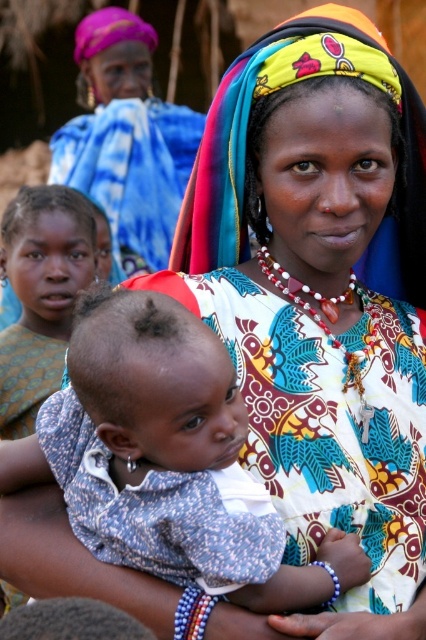
You are a photographer standing at the position of the central woman holding the baby. You want to take a photo of the matte colorful headscarf at upper center and the other woman wearing a pink headscarf and blue garment. Are both subjects within your camera lens field of view if your camera has a 50 meter focal length?

The two subjects are 50.64 meters apart. Since the camera has a 50 meter focal length, the distance between them exceeds the focal length, so they cannot both be in the same frame. Adjust your position or use a different lens.

You are an observer looking at the scene. Which object is wider between the blue dotted fabric baby at center and the matte colorful headscarf at upper center?

The blue dotted fabric baby at center has a lesser width compared to the matte colorful headscarf at upper center, so the matte colorful headscarf at upper center is wider.

You are an artist trying to paint the scene. You notice the matte colorful headscarf at upper center and the matte brown skin at center. Which object should you paint first if you want to start with the larger one?

The matte colorful headscarf at upper center is bigger than the matte brown skin at center, so you should paint the matte colorful headscarf at upper center first.